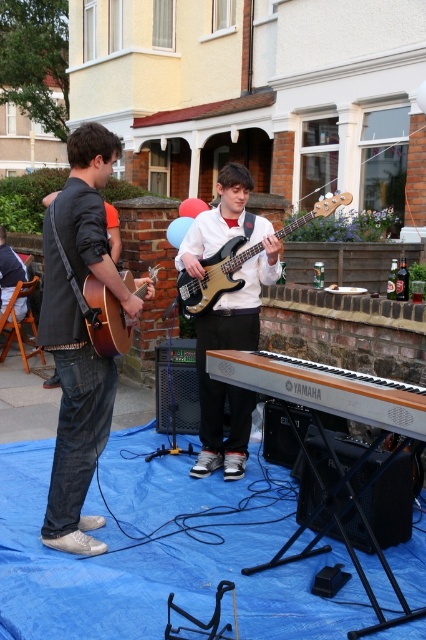
You are standing in front of the stage and want to know which point is closer to you. The points are labeled as point 1 at coordinates point [104,179] and point 2 at coordinates point [89,280]. Which point is closer to you?

Point 2 at coordinates point [89,280] is closer to you because it is less further to the camera than point 1 at coordinates point [104,179].

You are a photographer trying to capture a closeup of the shiny black bass guitar at center without including the matte brown acoustic guitar at left in the shot. Is this possible given their positions?

The matte brown acoustic guitar at left is behind the shiny black bass guitar at center, so you can take a closeup of the shiny black bass guitar at center without including the matte brown acoustic guitar at left in the shot.

You are a photographer trying to capture a closeup of the black glossy bass guitar at center without including the denim jeans at left in the shot. Given their relative sizes, is this possible?

The denim jeans at left is narrower than the black glossy bass guitar at center, so it might be challenging to exclude the denim jeans at left from the frame if the bass guitar at center takes up most of the available space.